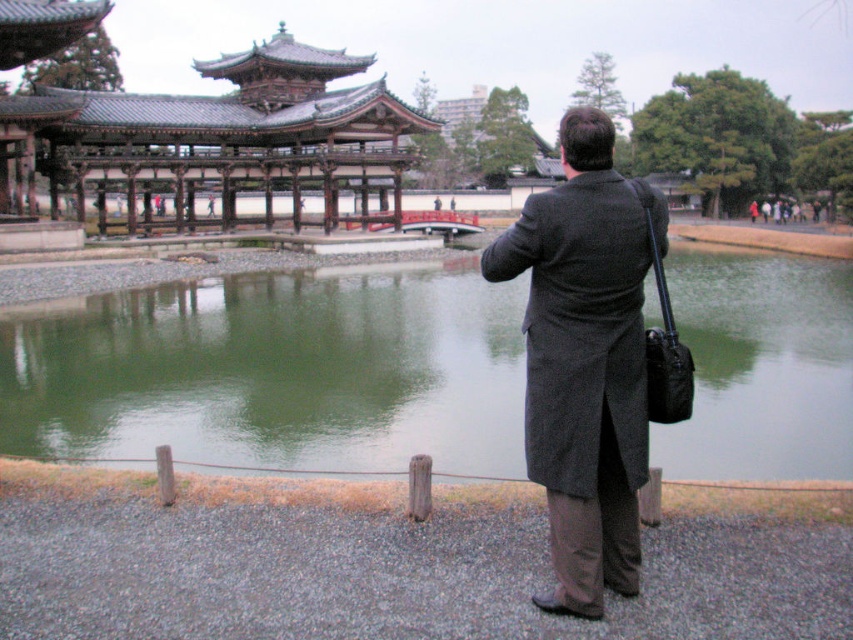
In the scene shown: Who is more distant from viewer, (x=259, y=346) or (x=614, y=522)?

The point (x=259, y=346) is behind.

Looking at this image, does green water at center appear on the left side of dark gray wool coat at center?

Correct, you'll find green water at center to the left of dark gray wool coat at center.

At what (x,y) coordinates should I click in order to perform the action: click on green water at center. Please return your answer as a coordinate pair (x, y). The image size is (853, 640). Looking at the image, I should click on (276, 371).